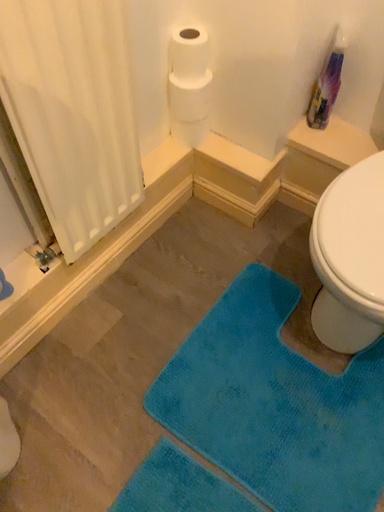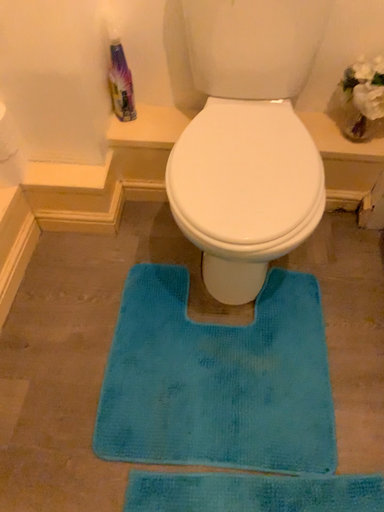
Question: Which way did the camera rotate in the video?

Choices:
 (A) rotated right
 (B) rotated left

Answer: (A)